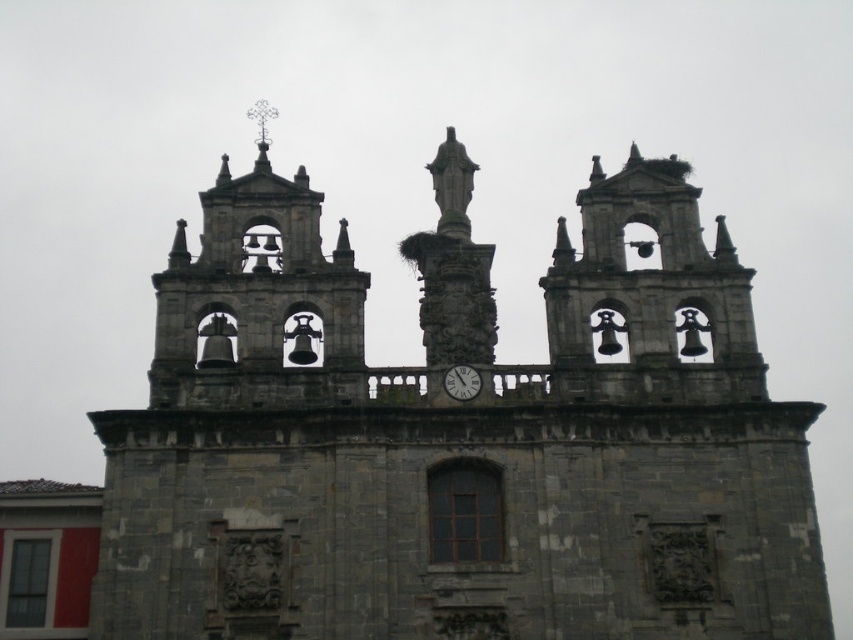
Between point (332, 269) and point (451, 365), which one is positioned behind?

The point (332, 269) is more distant.

Which is more to the left, dark gray stone bell tower at center left or white glossy clock at center?

Positioned to the left is dark gray stone bell tower at center left.

Is point (173, 330) positioned in front of point (466, 384)?

No, it is behind (466, 384).

I want to click on dark gray stone bell tower at center left, so click(x=258, y=298).

Between dark gray stone bell tower at center left and dark gray stone bell tower at upper center, which one appears on the left side from the viewer's perspective?

dark gray stone bell tower at center left is more to the left.

Which is behind, point (317, 228) or point (718, 257)?

The point (718, 257) is behind.

Identify the location of dark gray stone bell tower at center left. Image resolution: width=853 pixels, height=640 pixels. tap(258, 298).

Is point (718, 348) farther from viewer compared to point (462, 392)?

Yes, point (718, 348) is farther from viewer.

Does dark gray stone bell tower at upper center appear under white glossy clock at center?

No, dark gray stone bell tower at upper center is not below white glossy clock at center.

Which is behind, point (585, 230) or point (456, 384)?

The point (585, 230) is more distant.

Find the location of a particular element. This screenshot has width=853, height=640. dark gray stone bell tower at upper center is located at coordinates (648, 294).